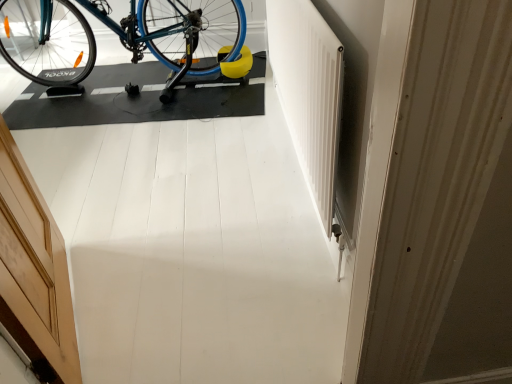
Question: Can you confirm if blue metallic bicycle at upper left is shorter than wooden door at left?

Choices:
 (A) yes
 (B) no

Answer: (A)

Question: Does blue metallic bicycle at upper left touch wooden door at left?

Choices:
 (A) no
 (B) yes

Answer: (A)

Question: Considering the relative sizes of blue metallic bicycle at upper left and wooden door at left in the image provided, is blue metallic bicycle at upper left bigger than wooden door at left?

Choices:
 (A) yes
 (B) no

Answer: (A)

Question: Is blue metallic bicycle at upper left positioned in front of wooden door at left?

Choices:
 (A) no
 (B) yes

Answer: (A)

Question: Is blue metallic bicycle at upper left not close to wooden door at left?

Choices:
 (A) yes
 (B) no

Answer: (A)

Question: Does blue metallic bicycle at upper left have a greater width compared to wooden door at left?

Choices:
 (A) yes
 (B) no

Answer: (A)

Question: Is wooden door at left with blue metallic bicycle at upper left?

Choices:
 (A) yes
 (B) no

Answer: (B)

Question: From the image's perspective, is wooden door at left on top of blue metallic bicycle at upper left?

Choices:
 (A) yes
 (B) no

Answer: (B)

Question: From a real-world perspective, is wooden door at left physically above blue metallic bicycle at upper left?

Choices:
 (A) yes
 (B) no

Answer: (A)

Question: Does wooden door at left lie behind blue metallic bicycle at upper left?

Choices:
 (A) no
 (B) yes

Answer: (A)

Question: Does wooden door at left come in front of blue metallic bicycle at upper left?

Choices:
 (A) yes
 (B) no

Answer: (A)

Question: Is wooden door at left at the right side of blue metallic bicycle at upper left?

Choices:
 (A) yes
 (B) no

Answer: (A)

Question: Considering the positions of blue metallic bicycle at upper left and wooden door at left in the image, is blue metallic bicycle at upper left bigger or smaller than wooden door at left?

Choices:
 (A) small
 (B) big

Answer: (B)